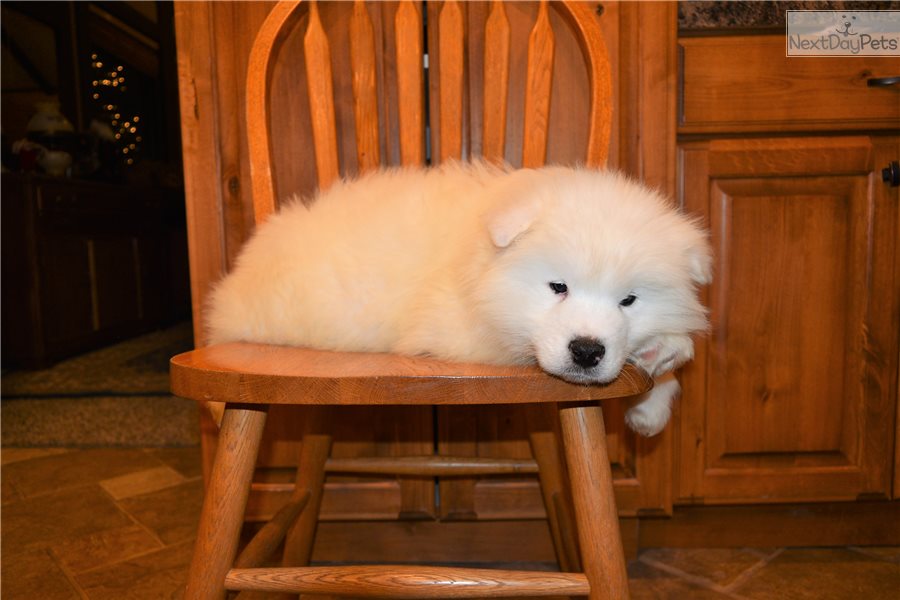
Find the location of `cabinet`. cabinet is located at coordinates (806, 348).